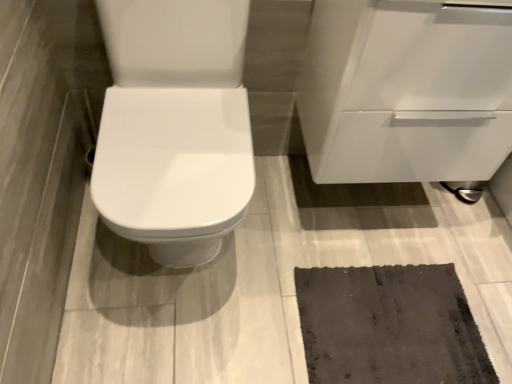
Where is `vacant space behind dark gray textured mat at lower right`? Image resolution: width=512 pixels, height=384 pixels. vacant space behind dark gray textured mat at lower right is located at coordinates (374, 219).